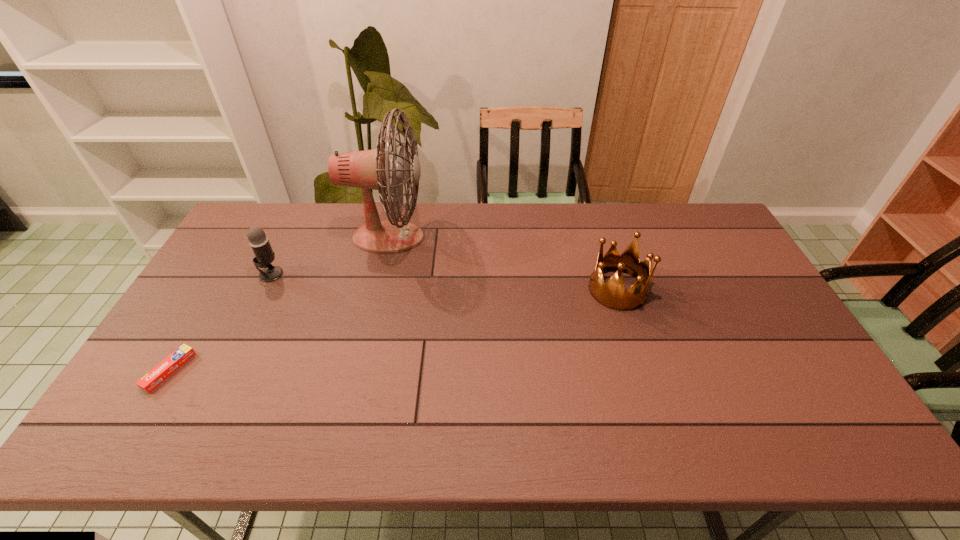
I want to click on object that is at the far edge, so click(370, 169).

Locate an element on the screen. Image resolution: width=960 pixels, height=540 pixels. microphone present at the left edge is located at coordinates (264, 256).

Locate an element on the screen. The image size is (960, 540). toothpaste located at the left edge is located at coordinates (168, 366).

Locate an element on the screen. blank space at the far edge of the desktop is located at coordinates (501, 239).

Locate an element on the screen. Image resolution: width=960 pixels, height=540 pixels. vacant space at the near edge of the desktop is located at coordinates (401, 430).

In order to click on vacant space at the right edge of the desktop in this screenshot , I will do `click(766, 374)`.

Where is `free space at the far left corner`? free space at the far left corner is located at coordinates (289, 205).

Image resolution: width=960 pixels, height=540 pixels. I want to click on free region at the far right corner of the desktop, so click(684, 237).

Image resolution: width=960 pixels, height=540 pixels. In the image, there is a desktop. What are the coordinates of `vacant space at the near right corner` in the screenshot? It's located at (810, 444).

This screenshot has width=960, height=540. In order to click on vacant point located between the microphone and the nearest object in this screenshot , I will do `click(220, 322)`.